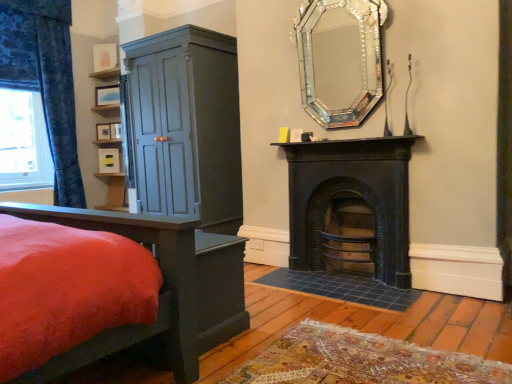
Question: From a real-world perspective, is white plastic power outlet at lower center physically below blue floral fabric at left?

Choices:
 (A) yes
 (B) no

Answer: (A)

Question: Can you confirm if white plastic power outlet at lower center is bigger than blue floral fabric at left?

Choices:
 (A) no
 (B) yes

Answer: (A)

Question: Is white plastic power outlet at lower center not near blue floral fabric at left?

Choices:
 (A) no
 (B) yes

Answer: (B)

Question: Is the depth of white plastic power outlet at lower center less than that of blue floral fabric at left?

Choices:
 (A) no
 (B) yes

Answer: (B)

Question: Is white plastic power outlet at lower center thinner than blue floral fabric at left?

Choices:
 (A) no
 (B) yes

Answer: (B)

Question: From a real-world perspective, is white plastic power outlet at lower center physically above blue floral fabric at left?

Choices:
 (A) no
 (B) yes

Answer: (A)

Question: Can you confirm if matte blue cabinet at left is positioned to the right of blue floral fabric at left?

Choices:
 (A) no
 (B) yes

Answer: (B)

Question: Is matte blue cabinet at left bigger than blue floral fabric at left?

Choices:
 (A) no
 (B) yes

Answer: (B)

Question: From the image's perspective, would you say matte blue cabinet at left is shown under blue floral fabric at left?

Choices:
 (A) yes
 (B) no

Answer: (A)

Question: From a real-world perspective, is matte blue cabinet at left located higher than blue floral fabric at left?

Choices:
 (A) no
 (B) yes

Answer: (A)

Question: Is the position of matte blue cabinet at left more distant than that of blue floral fabric at left?

Choices:
 (A) no
 (B) yes

Answer: (A)

Question: Is matte blue cabinet at left positioned with its back to blue floral fabric at left?

Choices:
 (A) no
 (B) yes

Answer: (A)

Question: From the image's perspective, is blue floral fabric curtain at left over white plastic power outlet at lower center?

Choices:
 (A) yes
 (B) no

Answer: (A)